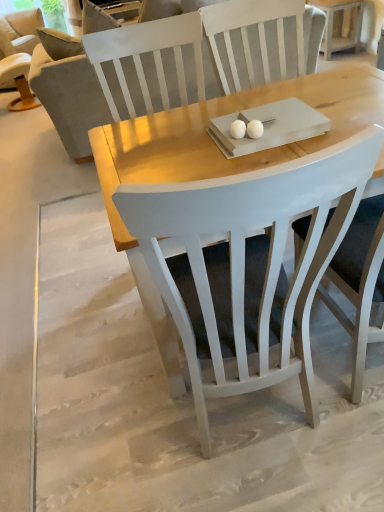
Image resolution: width=384 pixels, height=512 pixels. What do you see at coordinates (70, 98) in the screenshot?
I see `gray fabric couch at left` at bounding box center [70, 98].

In order to click on beige fabric chair at upper left, which ranks as the first chair in top-to-bottom order in this screenshot , I will do pyautogui.click(x=19, y=54).

What do you see at coordinates (340, 25) in the screenshot? This screenshot has width=384, height=512. I see `white wood side table at upper right` at bounding box center [340, 25].

The width and height of the screenshot is (384, 512). Describe the element at coordinates (246, 266) in the screenshot. I see `white wood chair at center, the 1th chair from the right` at that location.

Locate an element on the screen. gray fabric couch at left is located at coordinates (70, 98).

How much distance is there between gray fabric couch at left and white wood side table at upper right?

They are 2.15 meters apart.

How different are the orientations of gray fabric couch at left and white wood side table at upper right in degrees?

The angular difference between gray fabric couch at left and white wood side table at upper right is 142 degrees.

Which is more to the right, gray fabric couch at left or white wood side table at upper right?

white wood side table at upper right is more to the right.

Does gray fabric couch at left have a lesser height compared to white wood side table at upper right?

Incorrect, the height of gray fabric couch at left does not fall short of that of white wood side table at upper right.

Which is in front, white wood chair at center, the 1th chair from the right, or gray fabric couch at left?

white wood chair at center, the 1th chair from the right, is in front.

Find the location of `chair that appears below the gray fabric couch at left (from the image's perspective)`. chair that appears below the gray fabric couch at left (from the image's perspective) is located at coordinates click(x=246, y=266).

Between beige fabric chair at upper left, which is counted as the second chair, starting from the right, and white wood chair at center, the 1th chair from the right, which one has larger size?

beige fabric chair at upper left, which is counted as the second chair, starting from the right.

Are beige fabric chair at upper left, the first chair viewed from the left, and white wood chair at center, acting as the 2th chair starting from the top, located far from each other?

Yes, beige fabric chair at upper left, the first chair viewed from the left, and white wood chair at center, acting as the 2th chair starting from the top, are located far from each other.

Based on the photo, is beige fabric chair at upper left, placed as the second chair when sorted from front to back, spatially inside white wood chair at center, acting as the 2th chair starting from the top, or outside of it?

beige fabric chair at upper left, placed as the second chair when sorted from front to back, lies outside white wood chair at center, acting as the 2th chair starting from the top.

From a real-world perspective, between beige fabric chair at upper left, the first chair viewed from the left, and white wood chair at center, marked as the second chair in a left-to-right arrangement, who is vertically higher?

white wood chair at center, marked as the second chair in a left-to-right arrangement, from a real-world perspective.

Between white wood chair at center, marked as the second chair in a left-to-right arrangement, and beige fabric chair at upper left, the second chair from the bottom, which one has more height?

With more height is white wood chair at center, marked as the second chair in a left-to-right arrangement.

From a real-world perspective, which object rests below the other?

In real-world perspective, beige fabric chair at upper left, the first chair viewed from the left, is lower.

Between white wood chair at center, the first chair positioned from the front, and beige fabric chair at upper left, which is counted as the second chair, starting from the right, which one has larger size?

With larger size is beige fabric chair at upper left, which is counted as the second chair, starting from the right.

Do you think white wood chair at center, marked as the second chair in a left-to-right arrangement, is within beige fabric chair at upper left, the second chair from the bottom, or outside of it?

white wood chair at center, marked as the second chair in a left-to-right arrangement, cannot be found inside beige fabric chair at upper left, the second chair from the bottom.

From a real-world perspective, is white wood side table at upper right above or below white wood chair at center, the 1th chair from the right?

In terms of real-world spatial position, white wood side table at upper right is below white wood chair at center, the 1th chair from the right.

Is white wood side table at upper right directly adjacent to white wood chair at center, acting as the 2th chair starting from the top?

No, white wood side table at upper right is not with white wood chair at center, acting as the 2th chair starting from the top.

Which is in front, point (358, 31) or point (365, 154)?

The point (365, 154) is closer to the camera.

Looking at their sizes, would you say beige fabric chair at upper left, which ranks as the first chair in top-to-bottom order, is wider or thinner than gray fabric couch at left?

Considering their sizes, beige fabric chair at upper left, which ranks as the first chair in top-to-bottom order, looks broader than gray fabric couch at left.

The width and height of the screenshot is (384, 512). What are the coordinates of `couch that is below the beige fabric chair at upper left, which is counted as the second chair, starting from the right (from the image's perspective)` in the screenshot? It's located at (70, 98).

From the picture: Which point is more distant from viewer, (11,50) or (55,117)?

The point (11,50) is farther from the camera.

Measure the distance between beige fabric chair at upper left, the second chair from the bottom, and gray fabric couch at left.

37.39 inches.

Measure the distance from gray fabric couch at left to beige fabric chair at upper left, positioned as the first chair in back-to-front order.

gray fabric couch at left is 94.97 centimeters away from beige fabric chair at upper left, positioned as the first chair in back-to-front order.

Between gray fabric couch at left and beige fabric chair at upper left, which ranks as the first chair in top-to-bottom order, which one appears on the right side from the viewer's perspective?

gray fabric couch at left is more to the right.

From a real-world perspective, count 2nd chairs downward from the gray fabric couch at left and point to it. Please provide its 2D coordinates.

[(19, 54)]

Is gray fabric couch at left looking in the opposite direction of beige fabric chair at upper left, the second chair from the bottom?

No, gray fabric couch at left is not facing away from beige fabric chair at upper left, the second chair from the bottom.

Where is `couch lying in front of the white wood side table at upper right`? The image size is (384, 512). couch lying in front of the white wood side table at upper right is located at coordinates (70, 98).

Locate an element on the screen. The image size is (384, 512). the 1st chair located beneath the gray fabric couch at left (from a real-world perspective) is located at coordinates (246, 266).

Based on the photo, which object lies nearer to the anchor point gray fabric couch at left, beige fabric chair at upper left, placed as the second chair when sorted from front to back, or white wood chair at center, which is counted as the first chair, starting from the bottom?

Based on the image, beige fabric chair at upper left, placed as the second chair when sorted from front to back, appears to be nearer to gray fabric couch at left.

Looking at the image, which one is located closer to white wood chair at center, the 1th chair from the right, white wood side table at upper right or beige fabric chair at upper left, the second chair from the bottom?

The object closer to white wood chair at center, the 1th chair from the right, is white wood side table at upper right.

Looking at this image, considering their positions, is beige fabric chair at upper left, which ranks as the first chair in top-to-bottom order, positioned further to white wood side table at upper right than gray fabric couch at left?

beige fabric chair at upper left, which ranks as the first chair in top-to-bottom order, is positioned further to the anchor white wood side table at upper right.

From the image, which object appears to be farther from white wood side table at upper right, gray fabric couch at left or white wood chair at center, acting as the 2th chair starting from the top?

white wood chair at center, acting as the 2th chair starting from the top, is further to white wood side table at upper right.

Which object lies further to the anchor point white wood side table at upper right, white wood chair at center, acting as the 2th chair starting from the top, or beige fabric chair at upper left, positioned as the first chair in back-to-front order?

white wood chair at center, acting as the 2th chair starting from the top, is positioned further to the anchor white wood side table at upper right.

From the picture: Considering their positions, is gray fabric couch at left positioned closer to white wood chair at center, which is counted as the first chair, starting from the bottom, than beige fabric chair at upper left, positioned as the first chair in back-to-front order?

The object closer to white wood chair at center, which is counted as the first chair, starting from the bottom, is gray fabric couch at left.

Based on their spatial positions, is beige fabric chair at upper left, positioned as the first chair in back-to-front order, or white wood chair at center, the 1th chair from the right, closer to white wood side table at upper right?

beige fabric chair at upper left, positioned as the first chair in back-to-front order, is closer to white wood side table at upper right.

Looking at the image, which one is located closer to gray fabric couch at left, beige fabric chair at upper left, placed as the second chair when sorted from front to back, or white wood side table at upper right?

beige fabric chair at upper left, placed as the second chair when sorted from front to back, is closer to gray fabric couch at left.

The image size is (384, 512). Find the location of `couch between beige fabric chair at upper left, placed as the second chair when sorted from front to back, and white wood side table at upper right, in the horizontal direction`. couch between beige fabric chair at upper left, placed as the second chair when sorted from front to back, and white wood side table at upper right, in the horizontal direction is located at coordinates (70, 98).

This screenshot has width=384, height=512. In order to click on couch located between white wood chair at center, which is counted as the 2th chair, starting from the back, and white wood side table at upper right in the depth direction in this screenshot , I will do `click(70, 98)`.

You are a GUI agent. You are given a task and a screenshot of the screen. Output one action in this format:
    pyautogui.click(x=<x>, y=<y>)
    Task: Click on the couch positioned between white wood chair at center, the 1th chair from the right, and beige fabric chair at upper left, placed as the second chair when sorted from front to back, from near to far
    
    Given the screenshot: What is the action you would take?
    pyautogui.click(x=70, y=98)

Where is `side table located between white wood chair at center, the 1th chair from the right, and beige fabric chair at upper left, which is counted as the second chair, starting from the right, in the depth direction`? side table located between white wood chair at center, the 1th chair from the right, and beige fabric chair at upper left, which is counted as the second chair, starting from the right, in the depth direction is located at coordinates (340, 25).